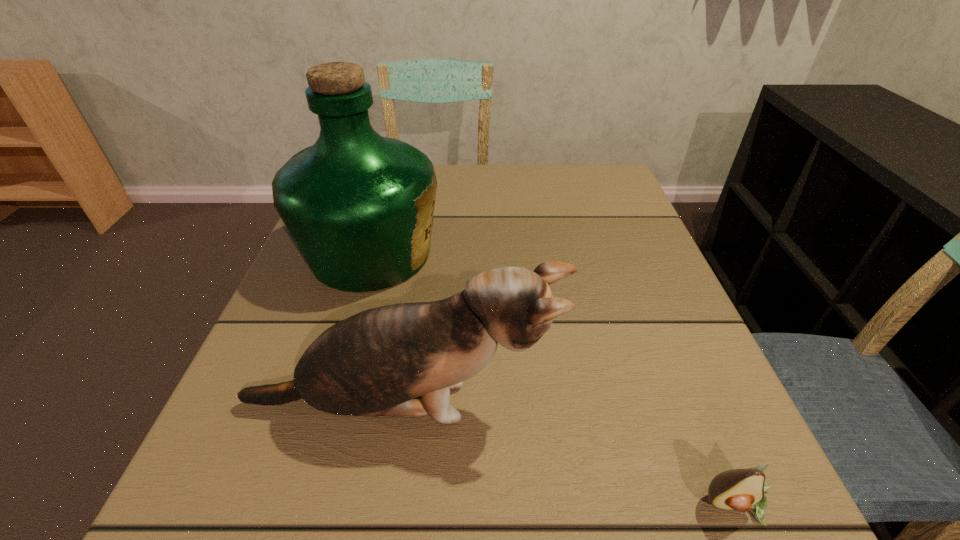
At what (x,y) coordinates should I click in order to perform the action: click on free spot between the second farthest object and the rightmost object. Please return your answer as a coordinate pair (x, y). This screenshot has width=960, height=540. Looking at the image, I should click on (569, 455).

Identify the location of vacant area between the farthest object and the nearest object. (555, 380).

Locate an element on the screen. The height and width of the screenshot is (540, 960). vacant space in between the second tallest object and the rightmost object is located at coordinates (569, 455).

I want to click on vacant area that lies between the cat and the rightmost object, so click(x=569, y=455).

You are a GUI agent. You are given a task and a screenshot of the screen. Output one action in this format:
    pyautogui.click(x=<x>, y=<y>)
    Task: Click on the object that can be found as the second closest to the farthest object
    Image resolution: width=960 pixels, height=540 pixels.
    Given the screenshot: What is the action you would take?
    pyautogui.click(x=743, y=490)

You are a GUI agent. You are given a task and a screenshot of the screen. Output one action in this format:
    pyautogui.click(x=<x>, y=<y>)
    Task: Click on the second closest object to the second tallest object
    
    Given the screenshot: What is the action you would take?
    pyautogui.click(x=743, y=490)